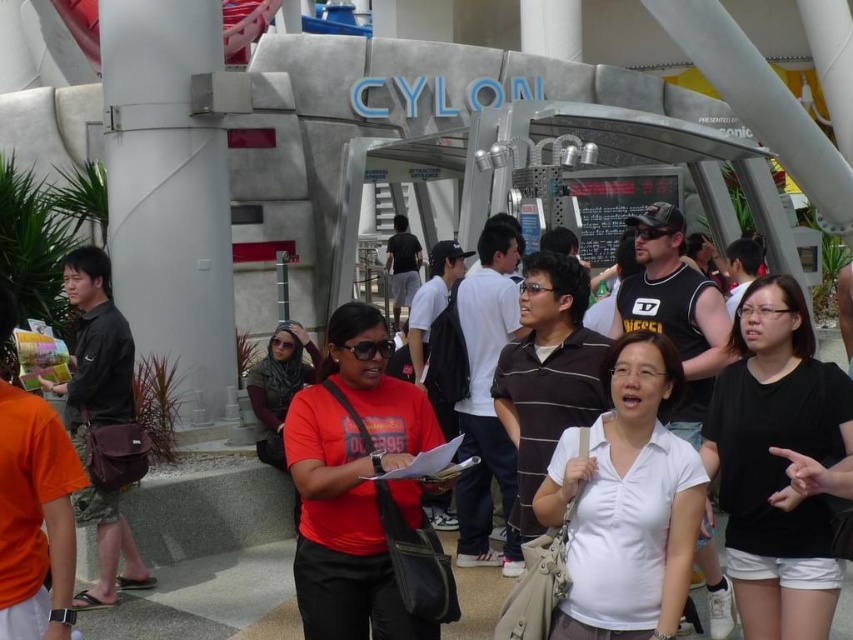
Between point (811, 428) and point (128, 355), which one is positioned in front?

Point (811, 428) is in front.

Which is below, black cotton shirt at center or matte black bag at left?

black cotton shirt at center

The width and height of the screenshot is (853, 640). What do you see at coordinates (776, 464) in the screenshot?
I see `black cotton shirt at center` at bounding box center [776, 464].

Locate an element on the screen. This screenshot has width=853, height=640. black cotton shirt at center is located at coordinates (776, 464).

Based on the photo, between black cotton shirt at center and brown striped polo shirt at center, which one is positioned higher?

brown striped polo shirt at center is above.

Does black cotton shirt at center have a smaller size compared to brown striped polo shirt at center?

No.

Identify the location of black cotton shirt at center. Image resolution: width=853 pixels, height=640 pixels. pos(776,464).

Is matte red shirt at center taller than brown striped polo shirt at center?

In fact, matte red shirt at center may be shorter than brown striped polo shirt at center.

Where is `matte red shirt at center`? The width and height of the screenshot is (853, 640). matte red shirt at center is located at coordinates (352, 483).

Where is `matte red shirt at center`? matte red shirt at center is located at coordinates (352, 483).